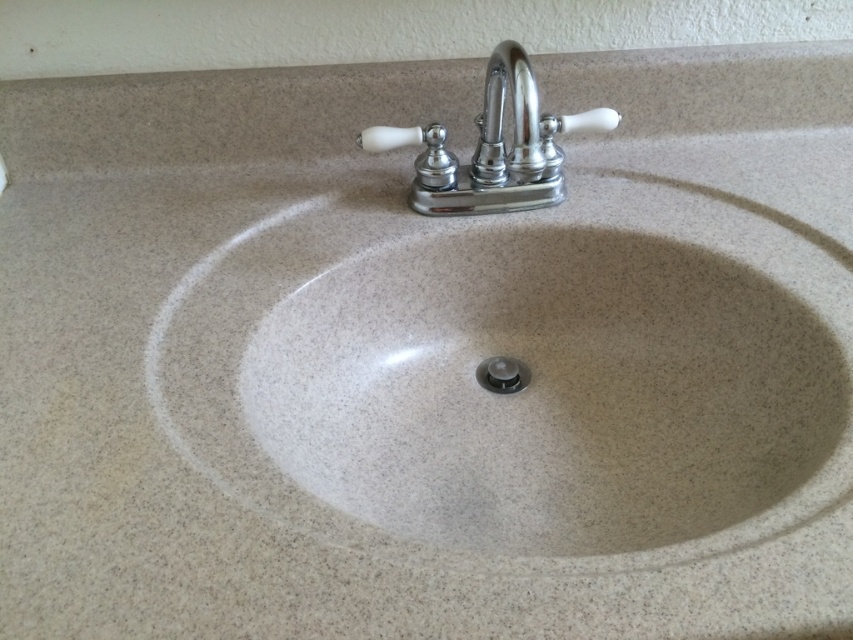
Is chrome/polished metal faucet at upper center taller than polished chrome faucet at upper center?

Yes, chrome/polished metal faucet at upper center is taller than polished chrome faucet at upper center.

Does chrome/polished metal faucet at upper center appear under polished chrome faucet at upper center?

Yes, chrome/polished metal faucet at upper center is below polished chrome faucet at upper center.

Which is behind, point (618, 118) or point (473, 163)?

Point (473, 163)

You are a GUI agent. You are given a task and a screenshot of the screen. Output one action in this format:
    pyautogui.click(x=<x>, y=<y>)
    Task: Click on the chrome/polished metal faucet at upper center
    The width and height of the screenshot is (853, 640).
    Given the screenshot: What is the action you would take?
    pyautogui.click(x=492, y=147)